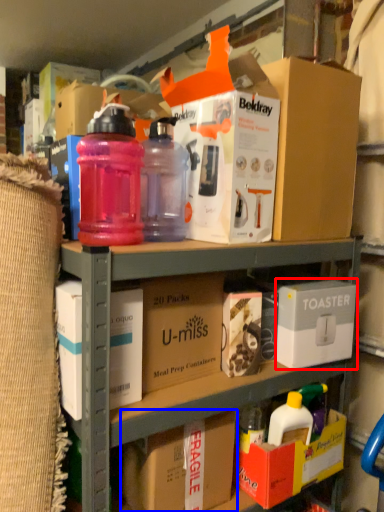
Question: Which point is further to the camera, storage box (highlighted by a red box) or cardboard box (highlighted by a blue box)?

Choices:
 (A) storage box
 (B) cardboard box

Answer: (A)